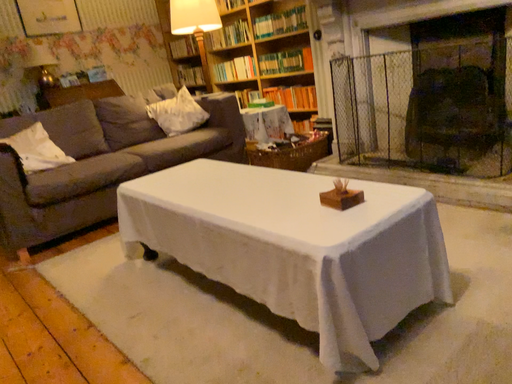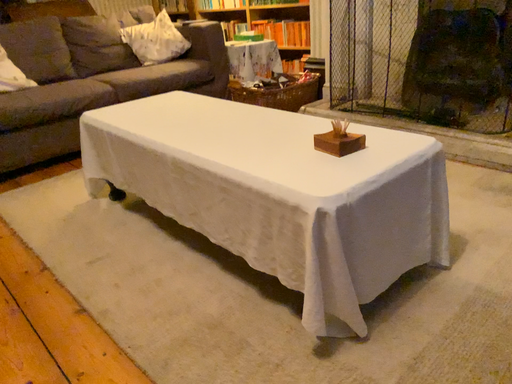
Question: Which way did the camera rotate in the video?

Choices:
 (A) rotated upward
 (B) rotated downward

Answer: (B)